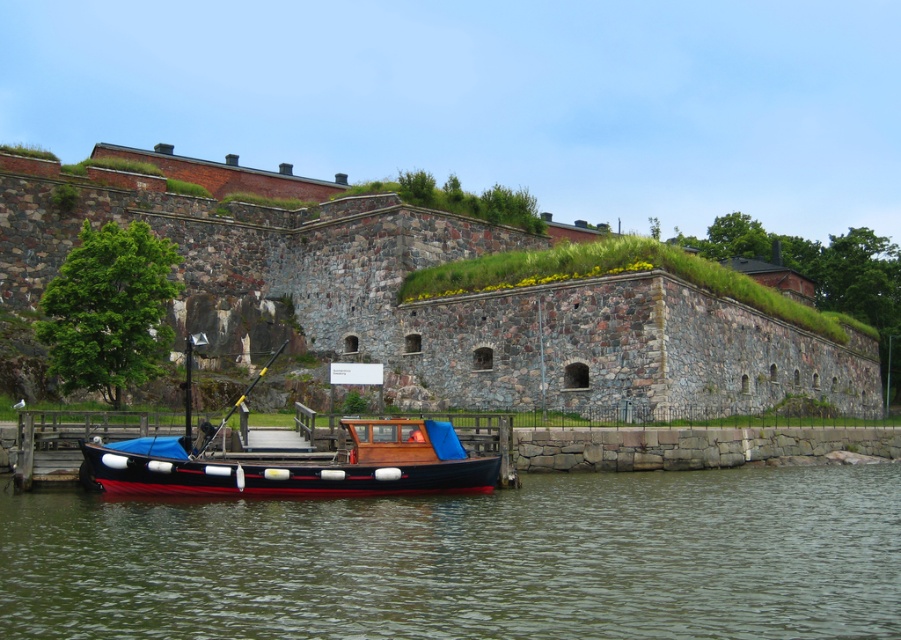
You are standing at the waterfront and want to reach a point that is 98.85 feet away from you. Is the point located at point coordinates point (305, 634) within the visible area of the scene?

The point (305, 634) is 98.85 feet away from the viewer, so it is within the visible area of the scene.